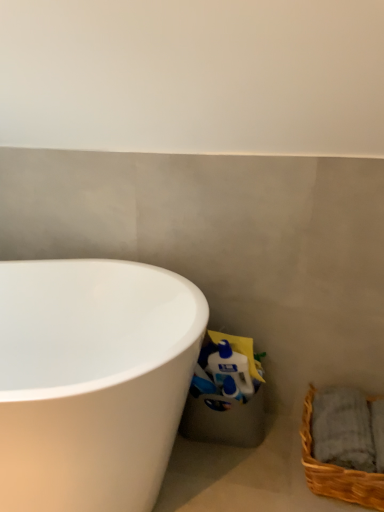
Question: Is white glossy bathtub at lower left facing away from brown woven basket at lower right?

Choices:
 (A) yes
 (B) no

Answer: (B)

Question: Is brown woven basket at lower right located within white glossy bathtub at lower left?

Choices:
 (A) yes
 (B) no

Answer: (B)

Question: Does white glossy bathtub at lower left have a smaller size compared to brown woven basket at lower right?

Choices:
 (A) no
 (B) yes

Answer: (A)

Question: Does white glossy bathtub at lower left have a greater width compared to brown woven basket at lower right?

Choices:
 (A) no
 (B) yes

Answer: (B)

Question: Is white glossy bathtub at lower left at the left side of brown woven basket at lower right?

Choices:
 (A) yes
 (B) no

Answer: (A)

Question: Considering the relative positions of white glossy bathtub at lower left and brown woven basket at lower right in the image provided, is white glossy bathtub at lower left in front of brown woven basket at lower right?

Choices:
 (A) yes
 (B) no

Answer: (A)

Question: Considering the relative sizes of brown woven basket at lower right and white glossy bathtub at lower left in the image provided, is brown woven basket at lower right taller than white glossy bathtub at lower left?

Choices:
 (A) no
 (B) yes

Answer: (A)

Question: Is brown woven basket at lower right not within white glossy bathtub at lower left?

Choices:
 (A) yes
 (B) no

Answer: (A)

Question: Is the position of brown woven basket at lower right more distant than that of white glossy bathtub at lower left?

Choices:
 (A) no
 (B) yes

Answer: (B)

Question: Is brown woven basket at lower right touching white glossy bathtub at lower left?

Choices:
 (A) yes
 (B) no

Answer: (B)

Question: Can you confirm if brown woven basket at lower right is positioned to the left of white glossy bathtub at lower left?

Choices:
 (A) yes
 (B) no

Answer: (B)

Question: Is brown woven basket at lower right thinner than white glossy bathtub at lower left?

Choices:
 (A) yes
 (B) no

Answer: (A)

Question: Considering the positions of brown woven basket at lower right and white glossy bathtub at lower left in the image, is brown woven basket at lower right taller or shorter than white glossy bathtub at lower left?

Choices:
 (A) short
 (B) tall

Answer: (A)